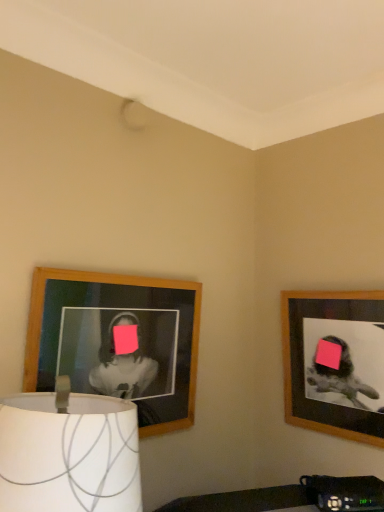
Locate an element on the screen. This screenshot has width=384, height=512. wooden frame at upper right, which is the second picture frame from left to right is located at coordinates (334, 362).

Where is `wooden frame at upper right, which is the second picture frame from left to right`? wooden frame at upper right, which is the second picture frame from left to right is located at coordinates (334, 362).

Is wooden picture frame at left, which is the first picture frame from left to right, positioned far away from wooden frame at upper right, which is the second picture frame from left to right?

No, wooden picture frame at left, which is the first picture frame from left to right, is not far from wooden frame at upper right, which is the second picture frame from left to right.

Which is more to the left, wooden picture frame at left, which is the first picture frame from left to right, or wooden frame at upper right, which is the second picture frame from left to right?

wooden picture frame at left, which is the first picture frame from left to right, is more to the left.

Does point (74, 278) come in front of point (366, 331)?

Yes, point (74, 278) is in front of point (366, 331).

From the image's perspective, is wooden picture frame at left, which is the first picture frame from left to right, located above or below wooden frame at upper right, the 1th picture frame positioned from the right?

wooden picture frame at left, which is the first picture frame from left to right, is situated higher than wooden frame at upper right, the 1th picture frame positioned from the right, in the image.

Can you tell me how much wooden frame at upper right, the 1th picture frame positioned from the right, and white fabric lampshade at lower left differ in facing direction?

103 degrees.

Is wooden frame at upper right, which is the second picture frame from left to right, not within white fabric lampshade at lower left?

That's correct, wooden frame at upper right, which is the second picture frame from left to right, is outside of white fabric lampshade at lower left.

Who is smaller, wooden frame at upper right, the 1th picture frame positioned from the right, or white fabric lampshade at lower left?

With smaller size is wooden frame at upper right, the 1th picture frame positioned from the right.

From a real-world perspective, is wooden frame at upper right, which is the second picture frame from left to right, positioned over white fabric lampshade at lower left based on gravity?

Indeed, from a real-world perspective, wooden frame at upper right, which is the second picture frame from left to right, stands above white fabric lampshade at lower left.

Can you confirm if wooden picture frame at left, which is the first picture frame from left to right, is bigger than white fabric lampshade at lower left?

No.

Does wooden picture frame at left, arranged as the 2th picture frame when viewed from the right, come in front of white fabric lampshade at lower left?

No, it is not.

Is point (116, 345) farther from camera compared to point (86, 463)?

That is True.

Do you think wooden picture frame at left, arranged as the 2th picture frame when viewed from the right, is within white fabric lampshade at lower left, or outside of it?

wooden picture frame at left, arranged as the 2th picture frame when viewed from the right, is outside white fabric lampshade at lower left.

From the image's perspective, is white fabric lampshade at lower left on top of wooden picture frame at left, arranged as the 2th picture frame when viewed from the right?

No, from the image's perspective, white fabric lampshade at lower left is not on top of wooden picture frame at left, arranged as the 2th picture frame when viewed from the right.

From a real-world perspective, who is located higher, white fabric lampshade at lower left or wooden picture frame at left, arranged as the 2th picture frame when viewed from the right?

From a 3D spatial view, wooden picture frame at left, arranged as the 2th picture frame when viewed from the right, is above.

Which object is closer to the camera, white fabric lampshade at lower left or wooden picture frame at left, arranged as the 2th picture frame when viewed from the right?

Positioned in front is white fabric lampshade at lower left.

Considering the sizes of white fabric lampshade at lower left and wooden picture frame at left, arranged as the 2th picture frame when viewed from the right, in the image, is white fabric lampshade at lower left wider or thinner than wooden picture frame at left, arranged as the 2th picture frame when viewed from the right,?

Considering their sizes, white fabric lampshade at lower left looks broader than wooden picture frame at left, arranged as the 2th picture frame when viewed from the right.

Between white fabric lampshade at lower left and wooden frame at upper right, which is the second picture frame from left to right, which one has more height?

Standing taller between the two is wooden frame at upper right, which is the second picture frame from left to right.

From the image's perspective, which is below, white fabric lampshade at lower left or wooden frame at upper right, the 1th picture frame positioned from the right?

white fabric lampshade at lower left appears lower in the image.

Is white fabric lampshade at lower left aimed at wooden frame at upper right, the 1th picture frame positioned from the right?

No, white fabric lampshade at lower left is not turned towards wooden frame at upper right, the 1th picture frame positioned from the right.

From the picture: Is white fabric lampshade at lower left far from wooden frame at upper right, the 1th picture frame positioned from the right?

No.

Consider the image. From the image's perspective, is wooden frame at upper right, the 1th picture frame positioned from the right, above wooden picture frame at left, arranged as the 2th picture frame when viewed from the right?

No, from the image's perspective, wooden frame at upper right, the 1th picture frame positioned from the right, is not over wooden picture frame at left, arranged as the 2th picture frame when viewed from the right.

Consider the image. Considering the relative sizes of wooden frame at upper right, which is the second picture frame from left to right, and wooden picture frame at left, which is the first picture frame from left to right, in the image provided, is wooden frame at upper right, which is the second picture frame from left to right, thinner than wooden picture frame at left, which is the first picture frame from left to right,?

Incorrect, the width of wooden frame at upper right, which is the second picture frame from left to right, is not less than that of wooden picture frame at left, which is the first picture frame from left to right.

Which is nearer, (377, 311) or (58, 307)?

Point (377, 311) is positioned farther from the camera compared to point (58, 307).

Which of these two, wooden frame at upper right, which is the second picture frame from left to right, or wooden picture frame at left, which is the first picture frame from left to right, stands taller?

Standing taller between the two is wooden frame at upper right, which is the second picture frame from left to right.

Identify the location of picture frame behind the wooden picture frame at left, arranged as the 2th picture frame when viewed from the right. Image resolution: width=384 pixels, height=512 pixels. (334, 362).

At what (x,y) coordinates should I click in order to perform the action: click on the 1st picture frame positioned above the white fabric lampshade at lower left (from a real-world perspective). Please return your answer as a coordinate pair (x, y). This screenshot has width=384, height=512. Looking at the image, I should click on (334, 362).

Considering their positions, is white fabric lampshade at lower left positioned closer to wooden frame at upper right, which is the second picture frame from left to right, than wooden picture frame at left, which is the first picture frame from left to right?

wooden picture frame at left, which is the first picture frame from left to right, is positioned closer to the anchor wooden frame at upper right, which is the second picture frame from left to right.

Looking at this image, based on their spatial positions, is wooden frame at upper right, which is the second picture frame from left to right, or white fabric lampshade at lower left closer to wooden picture frame at left, which is the first picture frame from left to right?

white fabric lampshade at lower left is positioned closer to the anchor wooden picture frame at left, which is the first picture frame from left to right.

Which object lies further to the anchor point wooden picture frame at left, which is the first picture frame from left to right, white fabric lampshade at lower left or wooden frame at upper right, which is the second picture frame from left to right?

wooden frame at upper right, which is the second picture frame from left to right.

Which object lies further to the anchor point white fabric lampshade at lower left, wooden frame at upper right, which is the second picture frame from left to right, or wooden picture frame at left, arranged as the 2th picture frame when viewed from the right?

wooden frame at upper right, which is the second picture frame from left to right, is further to white fabric lampshade at lower left.

Which object lies nearer to the anchor point white fabric lampshade at lower left, wooden picture frame at left, arranged as the 2th picture frame when viewed from the right, or wooden frame at upper right, the 1th picture frame positioned from the right?

wooden picture frame at left, arranged as the 2th picture frame when viewed from the right, is positioned closer to the anchor white fabric lampshade at lower left.

Estimate the real-world distances between objects in this image. Which object is closer to wooden frame at upper right, the 1th picture frame positioned from the right, wooden picture frame at left, which is the first picture frame from left to right, or white fabric lampshade at lower left?

wooden picture frame at left, which is the first picture frame from left to right, is positioned closer to the anchor wooden frame at upper right, the 1th picture frame positioned from the right.

Where is `picture frame situated between white fabric lampshade at lower left and wooden frame at upper right, which is the second picture frame from left to right, from left to right`? The image size is (384, 512). picture frame situated between white fabric lampshade at lower left and wooden frame at upper right, which is the second picture frame from left to right, from left to right is located at coordinates (117, 341).